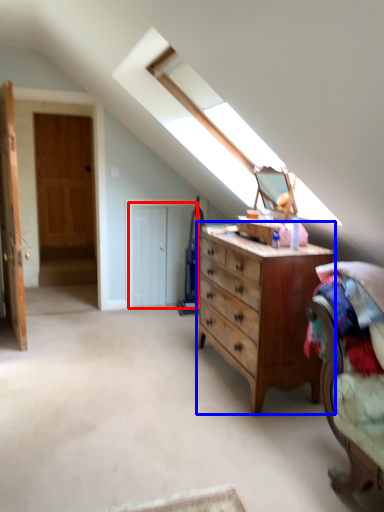
Question: Which object is closer to the camera taking this photo, door (highlighted by a red box) or chest of drawers (highlighted by a blue box)?

Choices:
 (A) door
 (B) chest of drawers

Answer: (B)